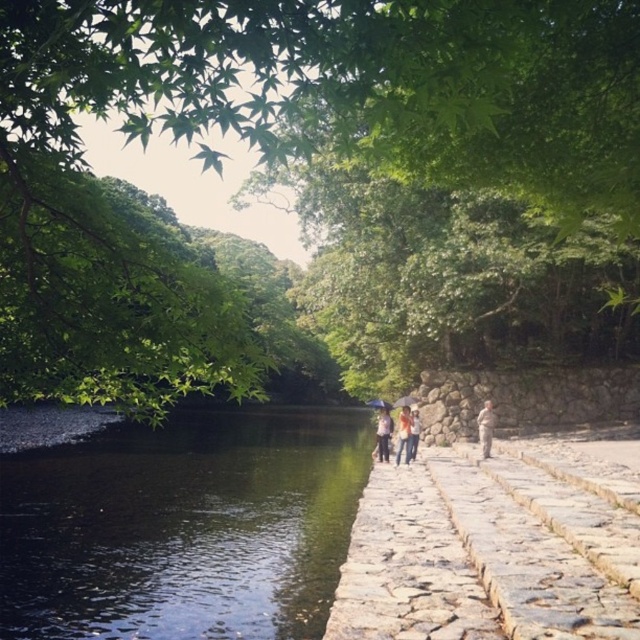
You are standing on the stone pathway and want to take a photo of the green leafy tree at upper center and the green reflective water at lower left. Which object should you point your camera towards first if you want to capture both in one shot?

The green reflective water at lower left should be framed first since the green leafy tree at upper center is to the right of it, allowing both to be captured in the same shot by positioning the water on the left side of the frame.

In the scene shown: You are a hiker who wants to cross the green reflective water at lower left to reach the orange cotton shirt at center. Given that the water is 42.69 feet away from the shirt, can you safely walk directly to the shirt without getting wet?

The distance between the green reflective water at lower left and the orange cotton shirt at center is 42.69 feet. Since the water is at the lower left and the shirt is at the center, you would need to walk around the water or find a path to reach the shirt without getting wet. The direct path might involve crossing the water, which is not advisable unless there is a bridge or dry path available.

You are standing at the stone pathway edge near the water. You see two points marked as point 1 at coordinates [401,444] and point 2 at coordinates [413,445]. Which point is closer to you?

Point 1 at coordinates [401,444] is closer to you than point 2 at coordinates [413,445].